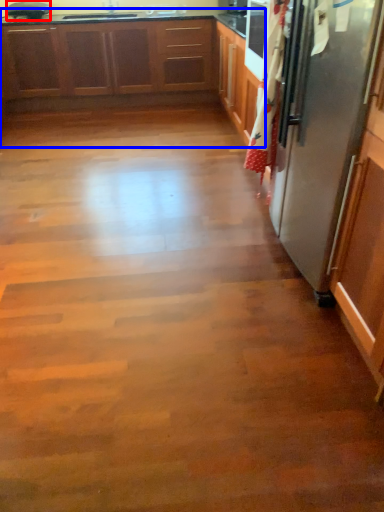
Question: Which object appears closest to the camera in this image, appliance (highlighted by a red box) or cabinetry (highlighted by a blue box)?

Choices:
 (A) appliance
 (B) cabinetry

Answer: (B)